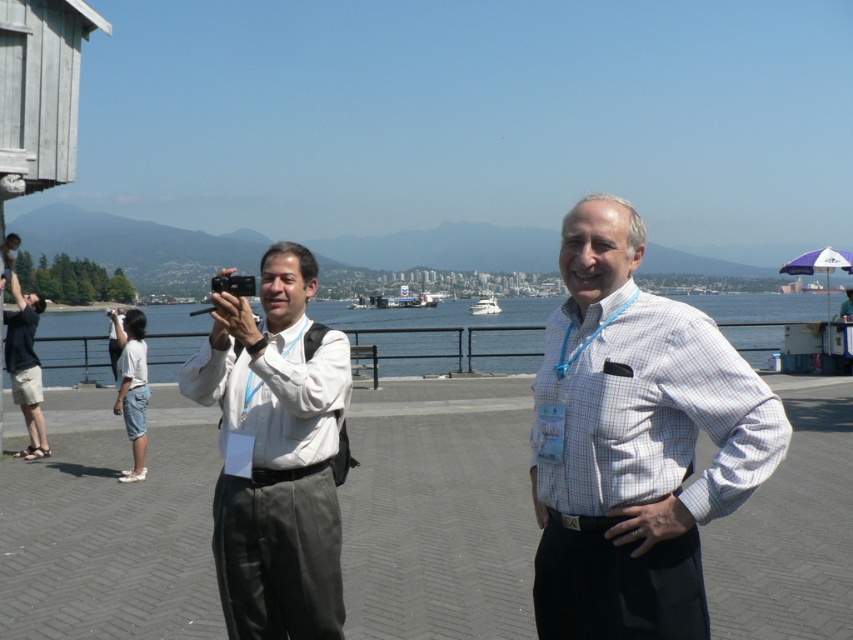
You are a photographer trying to capture a photo of the waterfront scene. You notice two points in the image labeled as point (543,541) and point (12,310). Which point is closer to your camera lens?

Point (543,541) is closer to the camera lens than point (12,310).

You are a photographer trying to capture a clear shot of both the white checkered shirt at center and the matte black shirt at left. Based on their positions, which one is closer to the camera?

The white checkered shirt at center is closer to the camera since it is positioned in front of the matte black shirt at left.

You are a photographer standing at the waterfront promenade. You notice the white matte shirt at center and the white glossy boat at center in your viewfinder. Which object should you focus on if you want to capture the taller one in your photo?

The white glossy boat at center is taller than the white matte shirt at center, so you should focus on the white glossy boat at center to capture the taller one in your photo.